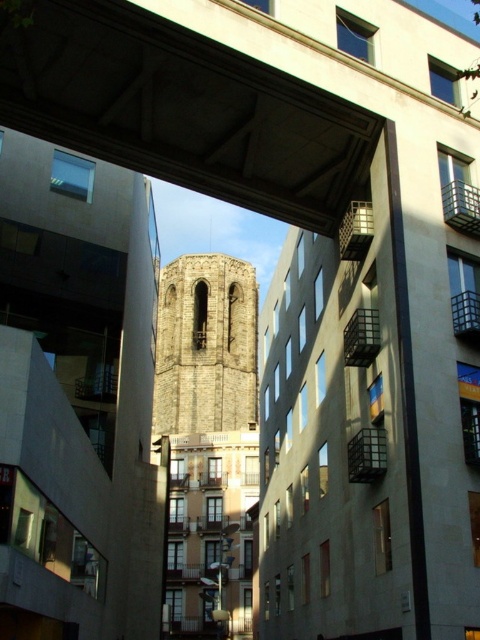
Which is below, concrete at center or brown stone bell tower at center?

brown stone bell tower at center is lower down.

From the picture: Who is higher up, concrete at center or brown stone bell tower at center?

concrete at center is higher up.

Is point (139, 134) closer to viewer compared to point (210, 400)?

Yes, it is in front of point (210, 400).

I want to click on concrete at center, so click(180, 108).